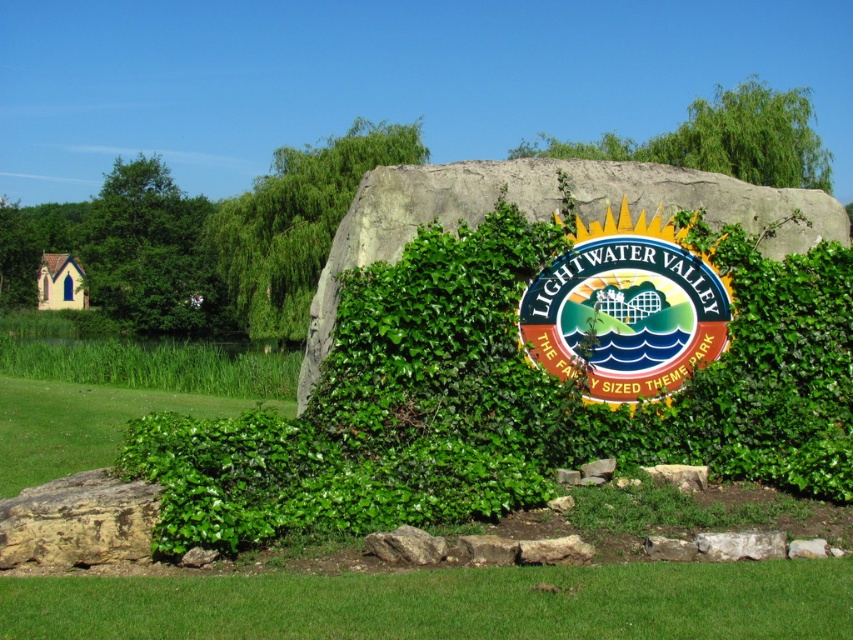
Question: Estimate the real-world distances between objects in this image. Which object is closer to the green leafy tree at left?

Choices:
 (A) green leafy grass at center
 (B) green grass at lower center

Answer: (A)

Question: Where is green leafy hedge at center located in relation to green leafy tree at left in the image?

Choices:
 (A) above
 (B) below

Answer: (B)

Question: Is metallic gold sign at center below green leafy tree at center?

Choices:
 (A) yes
 (B) no

Answer: (A)

Question: Which object appears farthest from the camera in this image?

Choices:
 (A) green grass at lower center
 (B) green leafy tree at left
 (C) green leafy hedge at center
 (D) metallic gold sign at center

Answer: (B)

Question: Can you confirm if green grass at lower center is positioned to the left of green leafy tree at upper center?

Choices:
 (A) yes
 (B) no

Answer: (A)

Question: Which object is farther from the camera taking this photo?

Choices:
 (A) green grass at lower center
 (B) green leafy tree at center

Answer: (B)